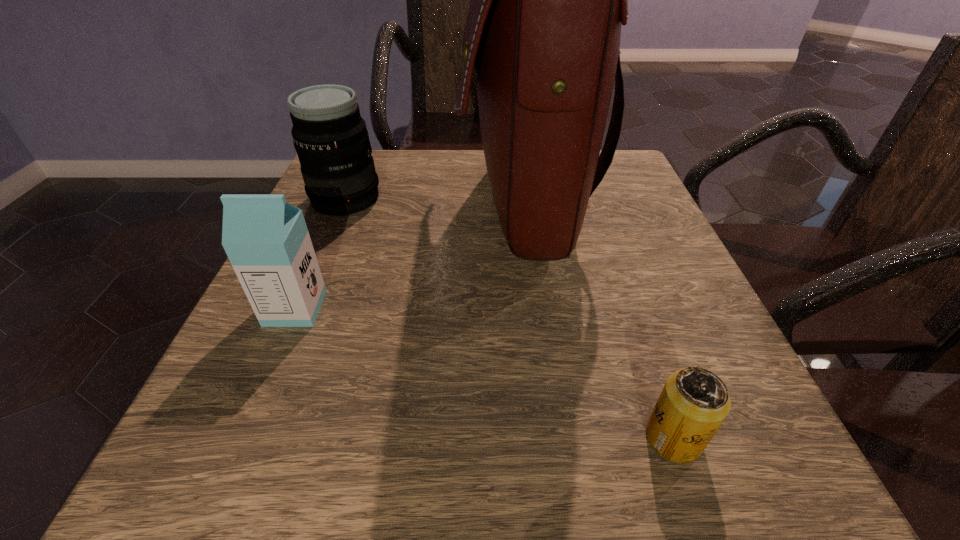
You are a GUI agent. You are given a task and a screenshot of the screen. Output one action in this format:
    pyautogui.click(x=<x>, y=<y>)
    Task: Click on the satchel
    This screenshot has height=540, width=960.
    Given the screenshot: What is the action you would take?
    pyautogui.click(x=543, y=29)

Locate an element on the screen. telephoto lens is located at coordinates (330, 137).

At what (x,y) coordinates should I click in order to perform the action: click on milk carton. Please return your answer as a coordinate pair (x, y). This screenshot has width=960, height=540. Looking at the image, I should click on (266, 239).

Locate an element on the screen. the nearest object is located at coordinates (694, 402).

This screenshot has width=960, height=540. In order to click on beer can in this screenshot , I will do `click(694, 402)`.

The width and height of the screenshot is (960, 540). Find the location of `free space located on the open flap of the satchel`. free space located on the open flap of the satchel is located at coordinates [x=364, y=206].

In order to click on vacant area situated 0.170m on the open flap of the satchel in this screenshot , I will do pos(378,206).

Identify the location of free space located 0.130m on the open flap of the satchel. (398, 206).

Identify the location of free space located on the right of the telephoto lens. (487, 199).

The width and height of the screenshot is (960, 540). Find the location of `free space located 0.360m on the right of the milk carton`. free space located 0.360m on the right of the milk carton is located at coordinates (552, 308).